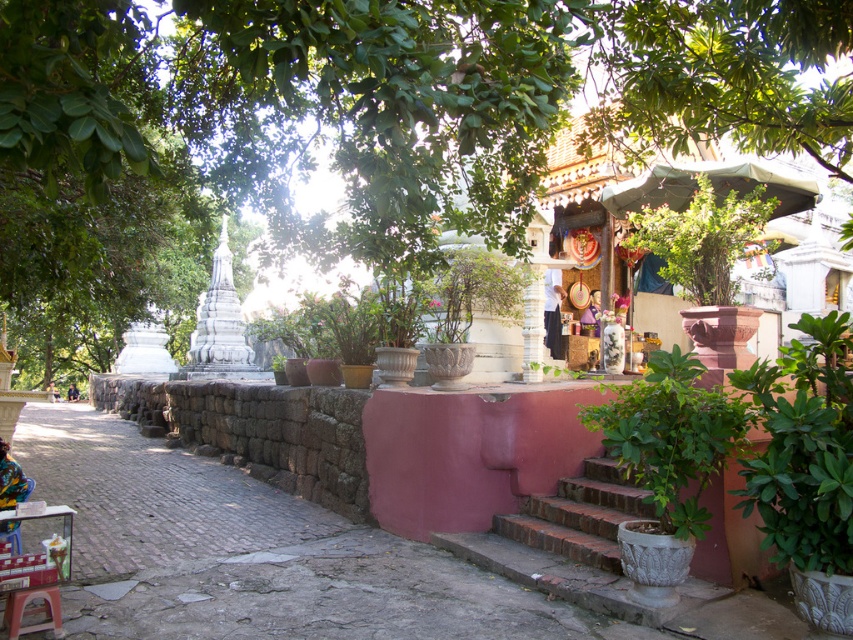
Which is behind, point (187, 65) or point (589, 541)?

The point (187, 65) is behind.

Based on the photo, does green leafy tree at upper center appear on the left side of brick stairs at center?

Yes, green leafy tree at upper center is to the left of brick stairs at center.

The height and width of the screenshot is (640, 853). In order to click on green leafy tree at upper center in this screenshot , I will do `click(358, 122)`.